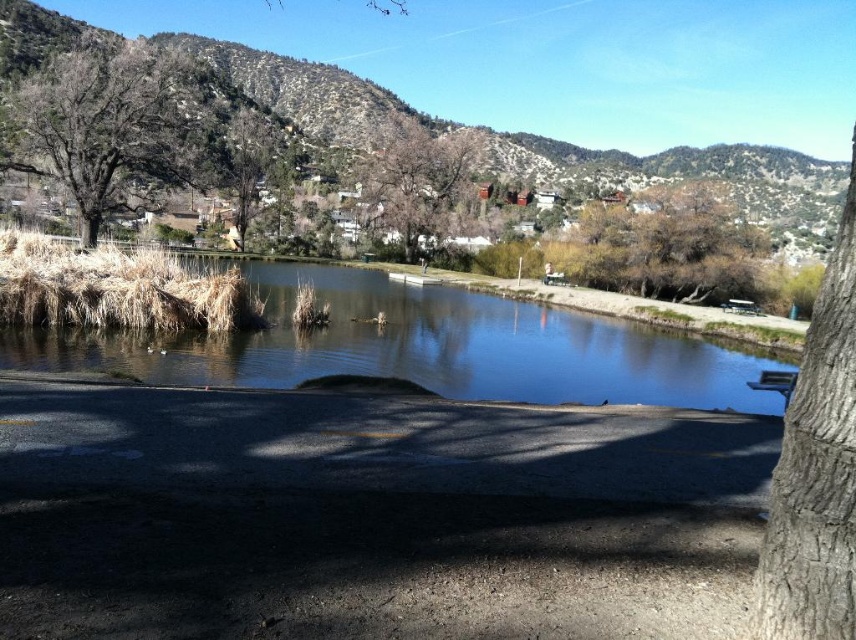
Question: Can you confirm if brown rough bark tree at right is positioned to the left of bare wood tree at center?

Choices:
 (A) yes
 (B) no

Answer: (B)

Question: Considering the real-world distances, which object is closest to the wooden park bench at right?

Choices:
 (A) bare wood tree at center
 (B) brown rough bark tree at right
 (C) wooden park bench at center

Answer: (B)

Question: Which point is closer to the camera taking this photo?

Choices:
 (A) (81, 220)
 (B) (843, 435)

Answer: (B)

Question: Which point is farther to the camera?

Choices:
 (A) (794, 474)
 (B) (438, 157)
 (C) (244, 164)

Answer: (B)

Question: From the image, what is the correct spatial relationship of brown rough bark tree at upper left in relation to wooden park bench at center?

Choices:
 (A) above
 (B) below

Answer: (A)

Question: Can you confirm if brown rough bark tree at right is smaller than green leafy tree at upper left?

Choices:
 (A) yes
 (B) no

Answer: (B)